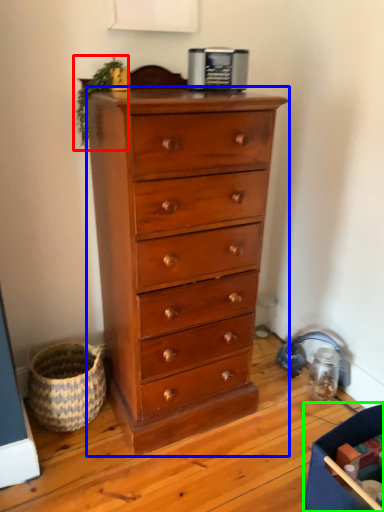
Question: Estimate the real-world distances between objects in this image. Which object is farther from plant (highlighted by a red box), chest of drawers (highlighted by a blue box) or storage box (highlighted by a green box)?

Choices:
 (A) chest of drawers
 (B) storage box

Answer: (B)